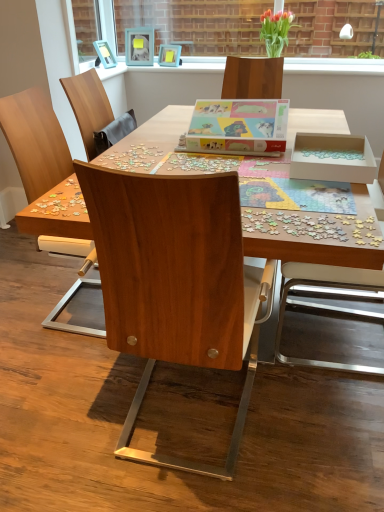
Question: Is clear glass vase at upper center wider than wooden chair at center, the second chair in the left-to-right sequence?

Choices:
 (A) no
 (B) yes

Answer: (A)

Question: Is wooden chair at center, the second chair in the left-to-right sequence, inside clear glass vase at upper center?

Choices:
 (A) yes
 (B) no

Answer: (B)

Question: Is clear glass vase at upper center taller than wooden chair at center, the second chair positioned from the right?

Choices:
 (A) yes
 (B) no

Answer: (B)

Question: Does clear glass vase at upper center have a lesser height compared to wooden chair at center, the second chair in the left-to-right sequence?

Choices:
 (A) no
 (B) yes

Answer: (B)

Question: Does clear glass vase at upper center have a smaller size compared to wooden chair at center, the second chair positioned from the right?

Choices:
 (A) no
 (B) yes

Answer: (B)

Question: From a real-world perspective, is clear glass vase at upper center on wooden chair at center, the second chair positioned from the right?

Choices:
 (A) no
 (B) yes

Answer: (B)

Question: Is white cardboard box at center wider than matte blue picture frame at upper center, marked as the 1th picture frame in a right-to-left arrangement?

Choices:
 (A) no
 (B) yes

Answer: (B)

Question: Is white cardboard box at center further to the viewer compared to matte blue picture frame at upper center, the second picture frame viewed from the left?

Choices:
 (A) yes
 (B) no

Answer: (B)

Question: Can you confirm if white cardboard box at center is positioned to the left of matte blue picture frame at upper center, the second picture frame viewed from the left?

Choices:
 (A) yes
 (B) no

Answer: (B)

Question: Is the position of white cardboard box at center less distant than that of matte blue picture frame at upper center, the second picture frame viewed from the left?

Choices:
 (A) no
 (B) yes

Answer: (B)

Question: Is white cardboard box at center thinner than matte blue picture frame at upper center, the second picture frame viewed from the left?

Choices:
 (A) yes
 (B) no

Answer: (B)

Question: Considering the relative sizes of white cardboard box at center and matte blue picture frame at upper center, marked as the 1th picture frame in a right-to-left arrangement, in the image provided, is white cardboard box at center taller than matte blue picture frame at upper center, marked as the 1th picture frame in a right-to-left arrangement,?

Choices:
 (A) yes
 (B) no

Answer: (B)

Question: Is wooden chair at center, marked as the 1th chair in a left-to-right arrangement, outside of teal matte picture frame at upper center, the 1th picture frame viewed from the left?

Choices:
 (A) no
 (B) yes

Answer: (B)